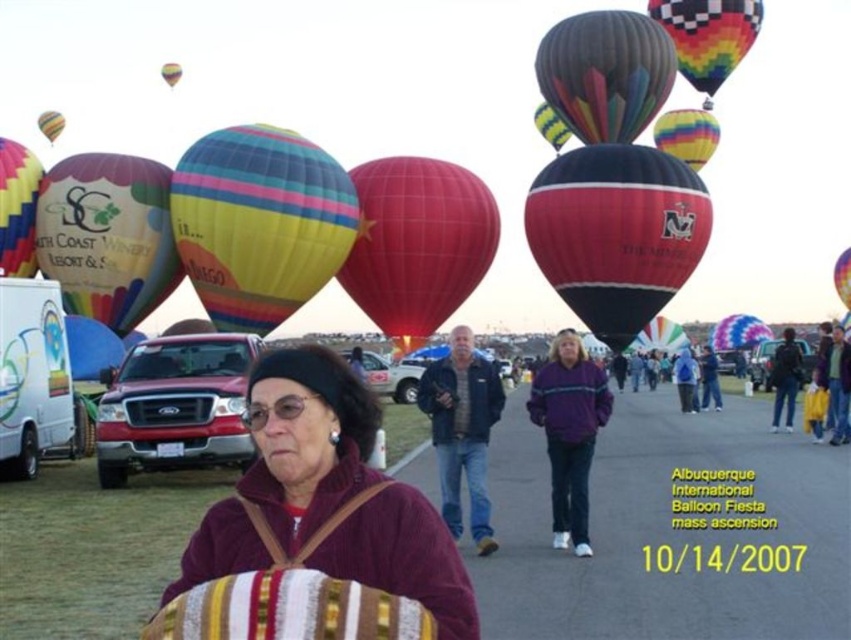
Consider the image. How distant is purple fleece jacket at center from rainbow striped balloon at upper right?

purple fleece jacket at center is 69.26 meters from rainbow striped balloon at upper right.

Does purple fleece jacket at center lie in front of rainbow striped balloon at upper right?

Yes, purple fleece jacket at center is closer to the viewer.

Where is `purple fleece jacket at center`? purple fleece jacket at center is located at coordinates (569, 433).

What are the coordinates of `rainbow striped balloon at upper right` in the screenshot? It's located at (687, 134).

Who is positioned more to the left, rainbow striped balloon at upper right or yellow-green striped fabric at upper center?

yellow-green striped fabric at upper center

Where is `rainbow striped balloon at upper right`? The width and height of the screenshot is (851, 640). rainbow striped balloon at upper right is located at coordinates (687, 134).

Find the location of a particular element. The height and width of the screenshot is (640, 851). rainbow striped balloon at upper right is located at coordinates (687, 134).

Does multicolored striped fabric hot air balloon at upper center lie behind dark blue jacket at center?

Yes, it is behind dark blue jacket at center.

Between multicolored striped fabric hot air balloon at upper center and dark blue jacket at center, which one has less height?

With less height is dark blue jacket at center.

Between point (648, 38) and point (777, 408), which one is positioned in front?

Point (777, 408)

This screenshot has height=640, width=851. Find the location of `multicolored striped fabric hot air balloon at upper center`. multicolored striped fabric hot air balloon at upper center is located at coordinates (604, 74).